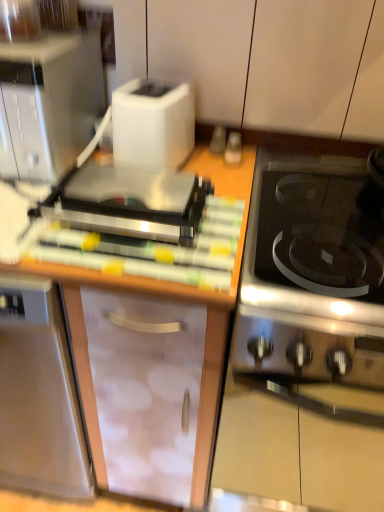
Question: Can you confirm if wooden cutting board at center is shorter than black glass cooktop at right?

Choices:
 (A) no
 (B) yes

Answer: (B)

Question: Could black glass cooktop at right be considered to be inside wooden cutting board at center?

Choices:
 (A) no
 (B) yes

Answer: (A)

Question: Does wooden cutting board at center have a greater height compared to black glass cooktop at right?

Choices:
 (A) no
 (B) yes

Answer: (A)

Question: Is the depth of wooden cutting board at center greater than that of black glass cooktop at right?

Choices:
 (A) yes
 (B) no

Answer: (A)

Question: Is wooden cutting board at center wider than black glass cooktop at right?

Choices:
 (A) no
 (B) yes

Answer: (B)

Question: Is white plastic toaster at upper center inside or outside of stainless steel oven at right?

Choices:
 (A) inside
 (B) outside

Answer: (B)

Question: From the image's perspective, is white plastic toaster at upper center positioned above or below stainless steel oven at right?

Choices:
 (A) below
 (B) above

Answer: (B)

Question: Is white plastic toaster at upper center to the left or to the right of stainless steel oven at right in the image?

Choices:
 (A) right
 (B) left

Answer: (B)

Question: From their relative heights in the image, would you say white plastic toaster at upper center is taller or shorter than stainless steel oven at right?

Choices:
 (A) short
 (B) tall

Answer: (A)

Question: From the image's perspective, is white plastic toaster at upper center located above or below wooden cutting board at center?

Choices:
 (A) above
 (B) below

Answer: (A)

Question: In terms of height, does white plastic toaster at upper center look taller or shorter compared to wooden cutting board at center?

Choices:
 (A) short
 (B) tall

Answer: (B)

Question: Considering the positions of point (120, 92) and point (6, 245), is point (120, 92) closer or farther from the camera than point (6, 245)?

Choices:
 (A) farther
 (B) closer

Answer: (A)

Question: Is white plastic toaster at upper center wider or thinner than wooden cutting board at center?

Choices:
 (A) wide
 (B) thin

Answer: (B)

Question: Looking at the image, does stainless steel oven at right seem bigger or smaller compared to white plastic toaster at upper center?

Choices:
 (A) small
 (B) big

Answer: (B)

Question: In the image, is stainless steel oven at right positioned in front of or behind white plastic toaster at upper center?

Choices:
 (A) behind
 (B) front

Answer: (B)